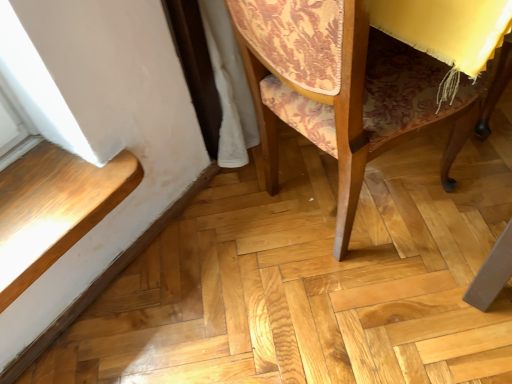
Locate an element on the screen. The width and height of the screenshot is (512, 384). vacant area that is situated to the right of wooden floor at lower left is located at coordinates (252, 257).